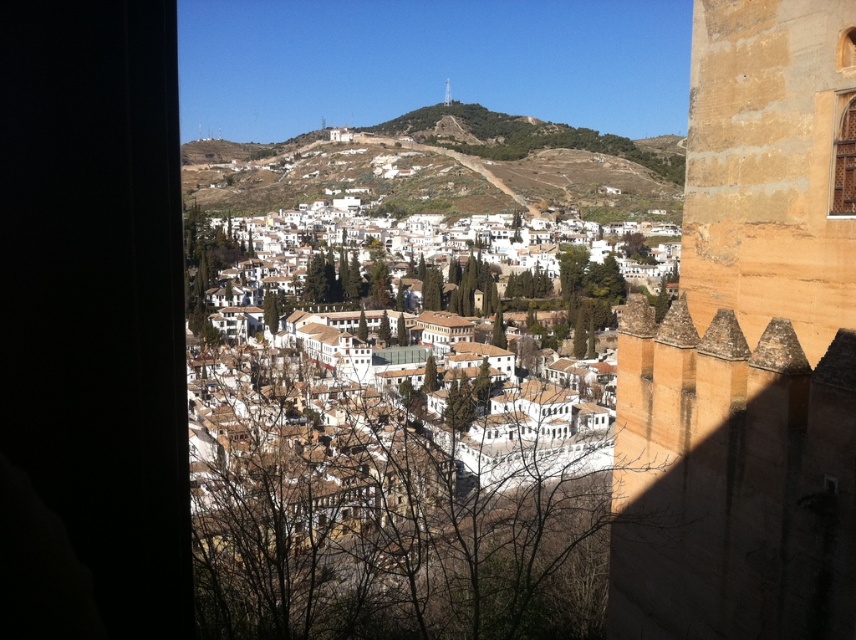
You are standing at the viewpoint behind the stone wall and want to take a photo of the white matte buildings at center. Which direction should you turn to ensure the brown earthy hillside at center is not blocking the view?

You should turn to the right to avoid the brown earthy hillside at center, which is positioned to the left of the white matte buildings at center.

You are an architect designing a new building in the town. You need to decide whether to place a large statue on the brown earthy hillside at center or the brown wooden window at upper right. Which location can accommodate the statue based on their sizes?

The brown earthy hillside at center is larger in size than the brown wooden window at upper right, so the statue should be placed on the brown earthy hillside at center as it has sufficient space.